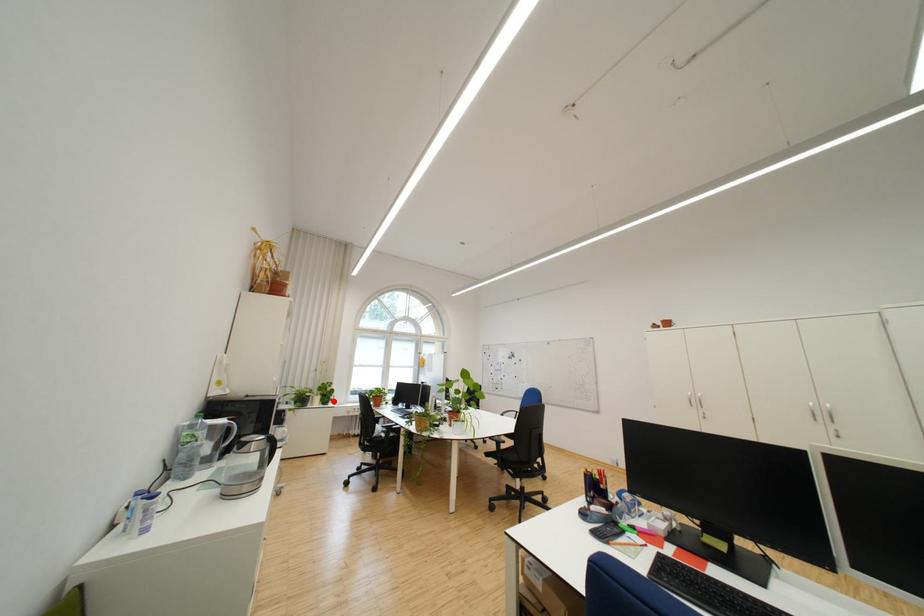
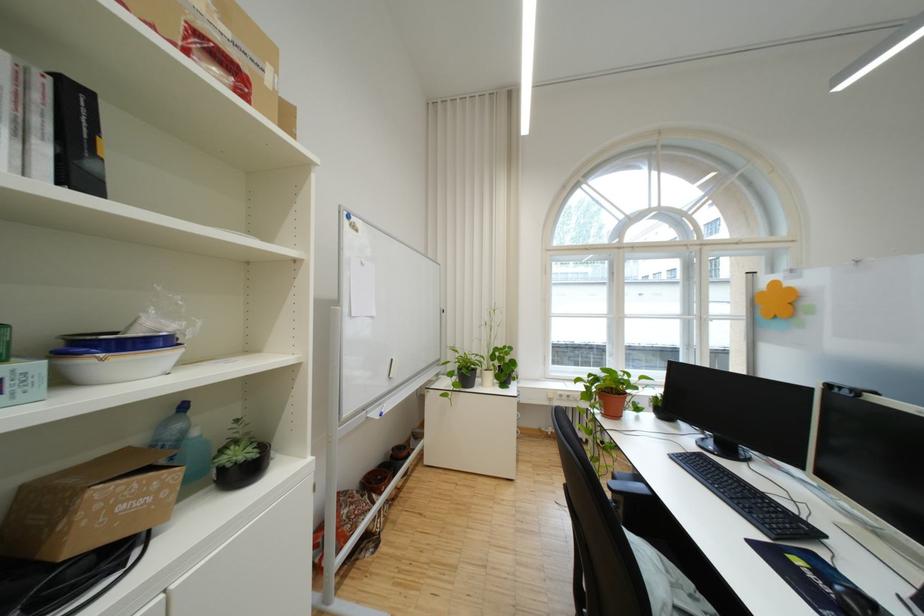
Locate, in the second image, the point that corresponds to the highlighted location in the first image.

(508, 379)